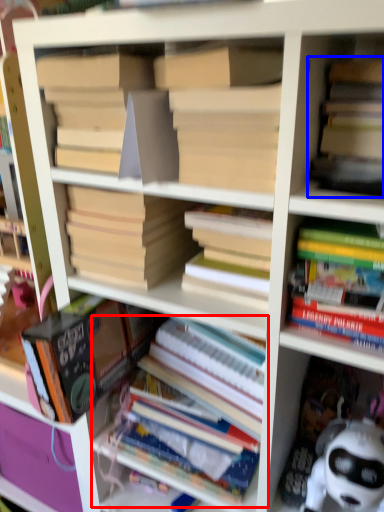
Question: Among these objects, which one is nearest to the camera, book (highlighted by a red box) or book (highlighted by a blue box)?

Choices:
 (A) book
 (B) book

Answer: (B)